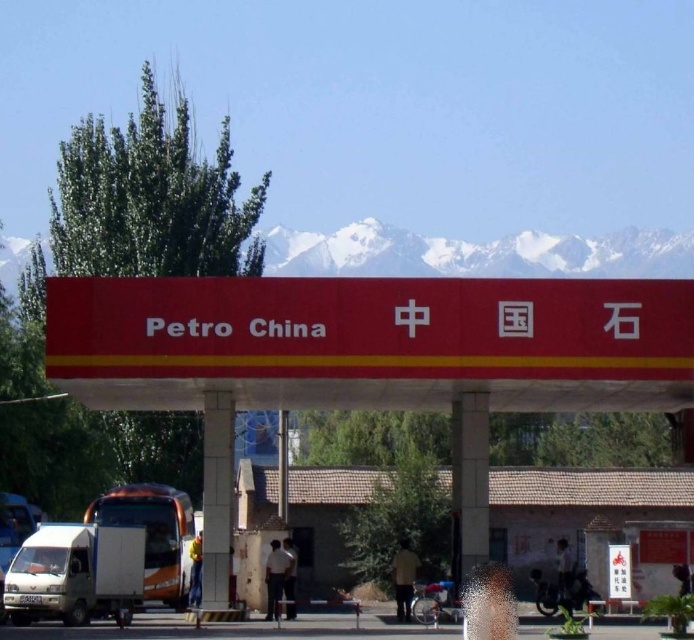
You are a delivery driver who needs to park your truck near the red matte sign at center. However, there is a white matte truck at lower left blocking the path. Can you drive straight ahead to reach the sign without moving the other truck?

The red matte sign at center is in front of the white matte truck at lower left, so the white matte truck at lower left is blocking the path. You cannot drive straight ahead to reach the sign without moving the other truck.

From the picture: You are standing at the PetroChina gas station with a red canopy under snowcapped mountains. You see two points marked as point 1 at coordinates (146,550) and point 2 at coordinates (12,528). Which point is closer to you?

Point 1 at coordinates (146,550) is closer to you because it is in front of point 2 at coordinates (12,528).